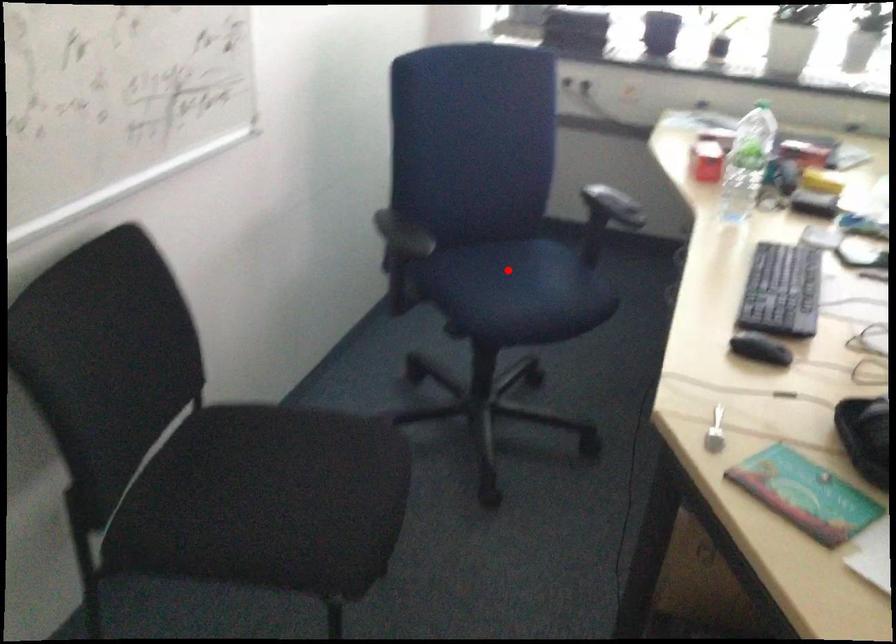
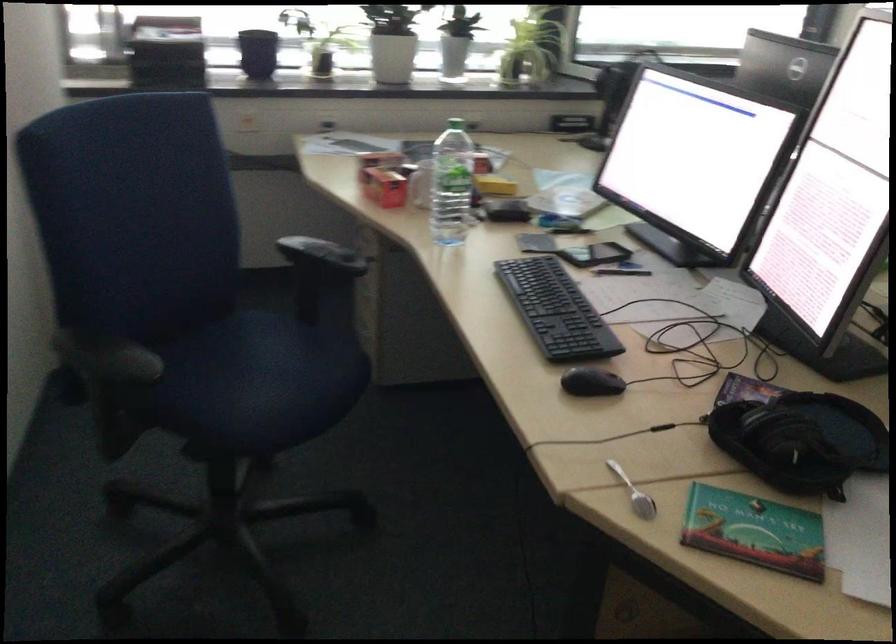
The point at the highlighted location is marked in the first image. Where is the corresponding point in the second image?

(245, 365)